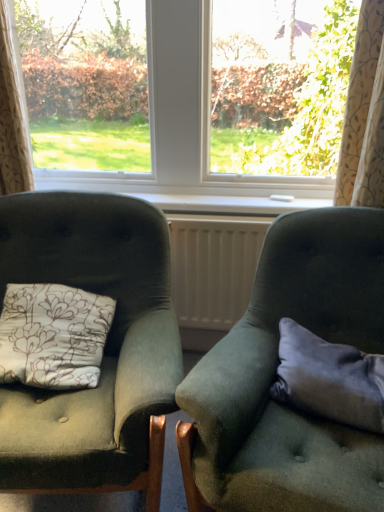
Question: Is gray fabric pillow at right closer to the viewer compared to velvet green armchair at left, which is the 2th chair in right-to-left order?

Choices:
 (A) yes
 (B) no

Answer: (B)

Question: Considering the relative sizes of gray fabric pillow at right and velvet green armchair at left, which is the 2th chair in right-to-left order, in the image provided, is gray fabric pillow at right shorter than velvet green armchair at left, which is the 2th chair in right-to-left order,?

Choices:
 (A) no
 (B) yes

Answer: (B)

Question: Can you confirm if gray fabric pillow at right is positioned to the right of velvet green armchair at left, the first chair when ordered from left to right?

Choices:
 (A) yes
 (B) no

Answer: (A)

Question: Considering the relative positions of gray fabric pillow at right and velvet green armchair at left, which is the 2th chair in right-to-left order, in the image provided, is gray fabric pillow at right to the left of velvet green armchair at left, which is the 2th chair in right-to-left order, from the viewer's perspective?

Choices:
 (A) no
 (B) yes

Answer: (A)

Question: Is gray fabric pillow at right thinner than velvet green armchair at left, the first chair when ordered from left to right?

Choices:
 (A) no
 (B) yes

Answer: (B)

Question: From the image's perspective, does gray fabric pillow at right appear lower than velvet green armchair at left, the first chair when ordered from left to right?

Choices:
 (A) no
 (B) yes

Answer: (B)

Question: From a real-world perspective, is beige floral fabric curtain at upper right, which ranks as the 2th curtain in left-to-right order, under velvet green armchair at left, the first chair when ordered from left to right?

Choices:
 (A) no
 (B) yes

Answer: (A)

Question: Can you confirm if beige floral fabric curtain at upper right, which ranks as the 2th curtain in left-to-right order, is positioned to the left of velvet green armchair at left, which is the 2th chair in right-to-left order?

Choices:
 (A) yes
 (B) no

Answer: (B)

Question: Is beige floral fabric curtain at upper right, acting as the 1th curtain starting from the right, thinner than velvet green armchair at left, which is the 2th chair in right-to-left order?

Choices:
 (A) no
 (B) yes

Answer: (B)

Question: Is the depth of beige floral fabric curtain at upper right, acting as the 1th curtain starting from the right, less than that of velvet green armchair at left, the first chair when ordered from left to right?

Choices:
 (A) no
 (B) yes

Answer: (A)

Question: Does beige floral fabric curtain at upper right, acting as the 1th curtain starting from the right, have a greater height compared to velvet green armchair at left, which is the 2th chair in right-to-left order?

Choices:
 (A) yes
 (B) no

Answer: (B)

Question: Considering the relative sizes of beige floral fabric curtain at upper right, acting as the 1th curtain starting from the right, and velvet green armchair at left, which is the 2th chair in right-to-left order, in the image provided, is beige floral fabric curtain at upper right, acting as the 1th curtain starting from the right, smaller than velvet green armchair at left, which is the 2th chair in right-to-left order,?

Choices:
 (A) no
 (B) yes

Answer: (B)

Question: From the image's perspective, is velvet green armchair at right, acting as the 2th chair starting from the left, over gray fabric pillow at right?

Choices:
 (A) yes
 (B) no

Answer: (B)